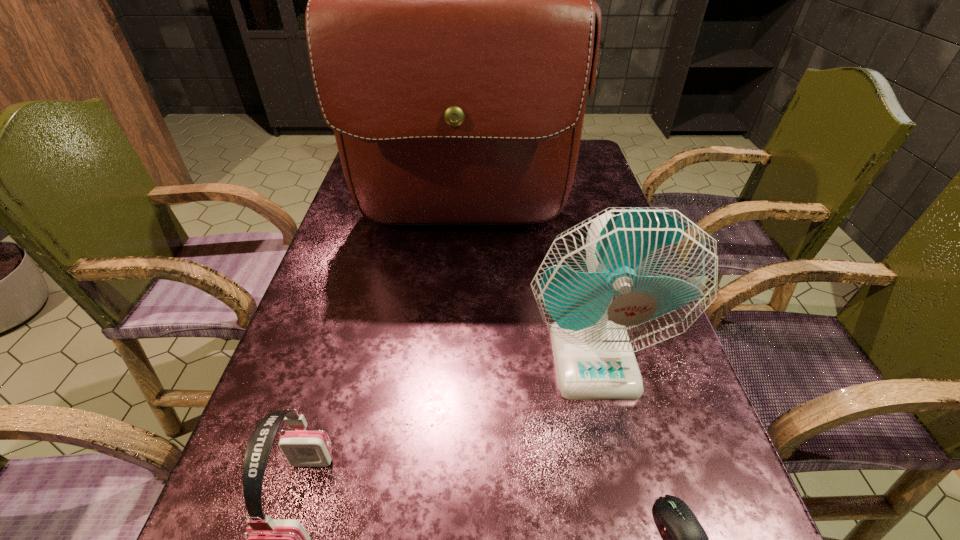
Where is `satchel`? satchel is located at coordinates (452, 35).

The height and width of the screenshot is (540, 960). I want to click on the farthest object, so click(x=452, y=35).

Where is `fan`? Image resolution: width=960 pixels, height=540 pixels. fan is located at coordinates (627, 278).

Where is `the second farthest object`? the second farthest object is located at coordinates (627, 278).

Where is `vacant area situated 0.070m on the open flap of the tallest object`? This screenshot has width=960, height=540. vacant area situated 0.070m on the open flap of the tallest object is located at coordinates (459, 278).

At what (x,y) coordinates should I click in order to perform the action: click on blank space located 0.100m in front of the second farthest object to face the airflow. Please return your answer as a coordinate pair (x, y). Looking at the image, I should click on (616, 458).

I want to click on object situated at the left edge, so click(452, 35).

The width and height of the screenshot is (960, 540). Find the location of `satchel that is at the right edge`. satchel that is at the right edge is located at coordinates pyautogui.click(x=452, y=35).

Identify the location of fan at the right edge. (627, 278).

You are a GUI agent. You are given a task and a screenshot of the screen. Output one action in this format:
    pyautogui.click(x=<x>, y=<y>)
    Task: Click on the free location at the left edge of the desktop
    Image resolution: width=960 pixels, height=540 pixels.
    Given the screenshot: What is the action you would take?
    pyautogui.click(x=336, y=347)